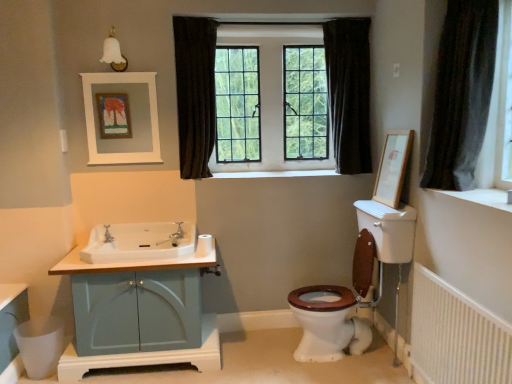
Identify the location of spots to the right of matte blue cabinet at left. (250, 357).